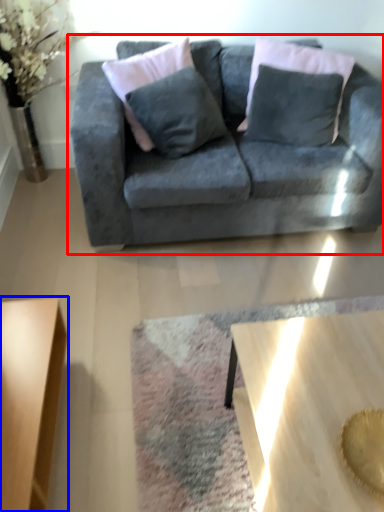
Question: Which object appears closest to the camera in this image, studio couch (highlighted by a red box) or coffee table (highlighted by a blue box)?

Choices:
 (A) studio couch
 (B) coffee table

Answer: (B)